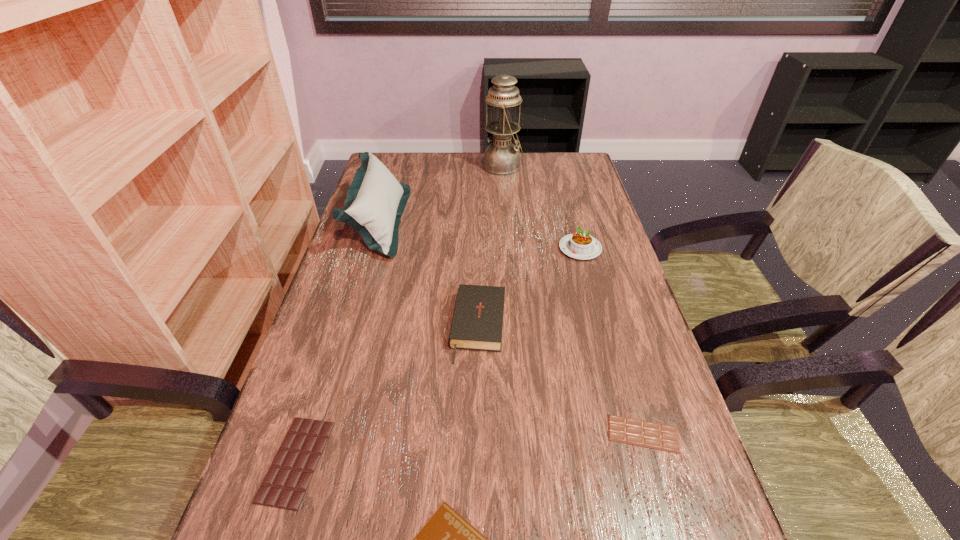
Locate an element on the screen. vacant space located 0.380m on the left of the oil lamp is located at coordinates (377, 166).

Locate an element on the screen. The height and width of the screenshot is (540, 960). vacant space located on the surface of the sixth shortest object is located at coordinates click(x=447, y=221).

The height and width of the screenshot is (540, 960). Identify the location of blank space located 0.100m on the left of the pudding. (523, 248).

Where is `free space located 0.210m on the left of the fourth nearest object`? This screenshot has width=960, height=540. free space located 0.210m on the left of the fourth nearest object is located at coordinates (360, 327).

At what (x,y) coordinates should I click in order to perform the action: click on blank space located on the back of the leftmost chocolate bar. Please return your answer as a coordinate pair (x, y). The width and height of the screenshot is (960, 540). Looking at the image, I should click on (351, 287).

Identify the location of free region located 0.210m on the back of the rightmost chocolate bar. coord(613,332).

What are the coordinates of `object that is at the far edge` in the screenshot? It's located at (501, 157).

Image resolution: width=960 pixels, height=540 pixels. I want to click on cushion that is positioned at the left edge, so click(375, 201).

Locate an element on the screen. The height and width of the screenshot is (540, 960). chocolate bar at the left edge is located at coordinates (285, 484).

This screenshot has height=540, width=960. I want to click on pudding positioned at the right edge, so click(581, 245).